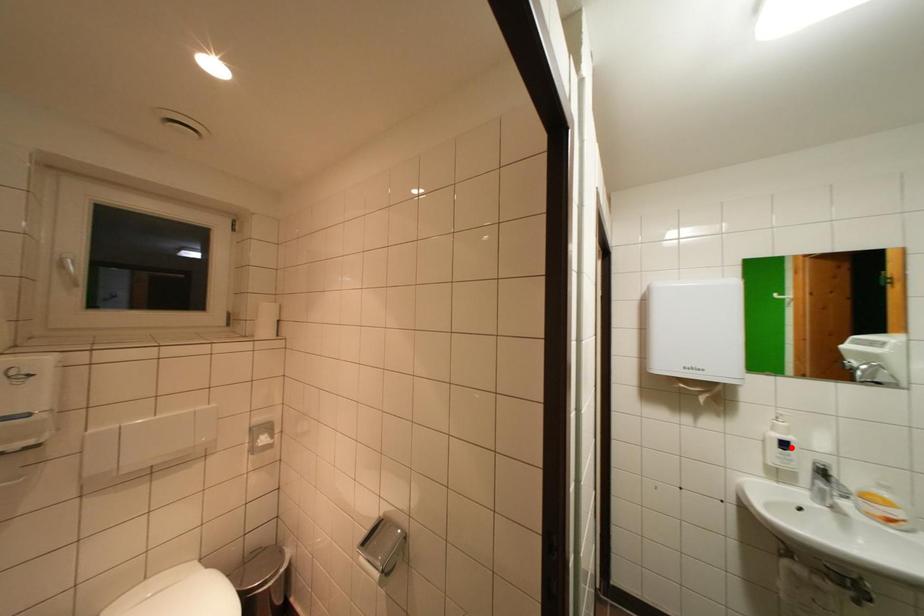
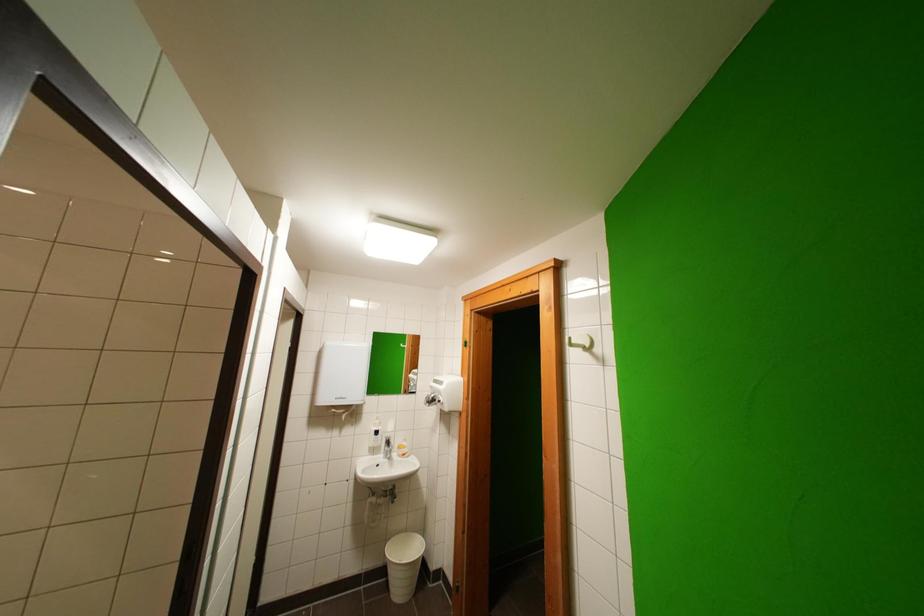
Question: I am providing you with two images of the same scene from different viewpoints. In image1, a red point is highlighted. Considering the same 3D point in image2, which of the following is correct?

Choices:
 (A) It is closer
 (B) It is farther

Answer: (B)